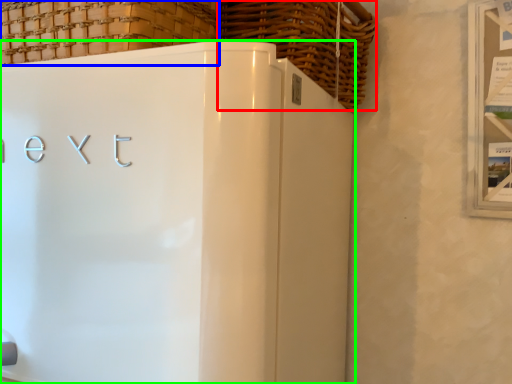
Question: Based on their relative distances, which object is nearer to basket (highlighted by a red box)? Choose from basket (highlighted by a blue box) and refrigerator (highlighted by a green box).

Choices:
 (A) basket
 (B) refrigerator

Answer: (A)